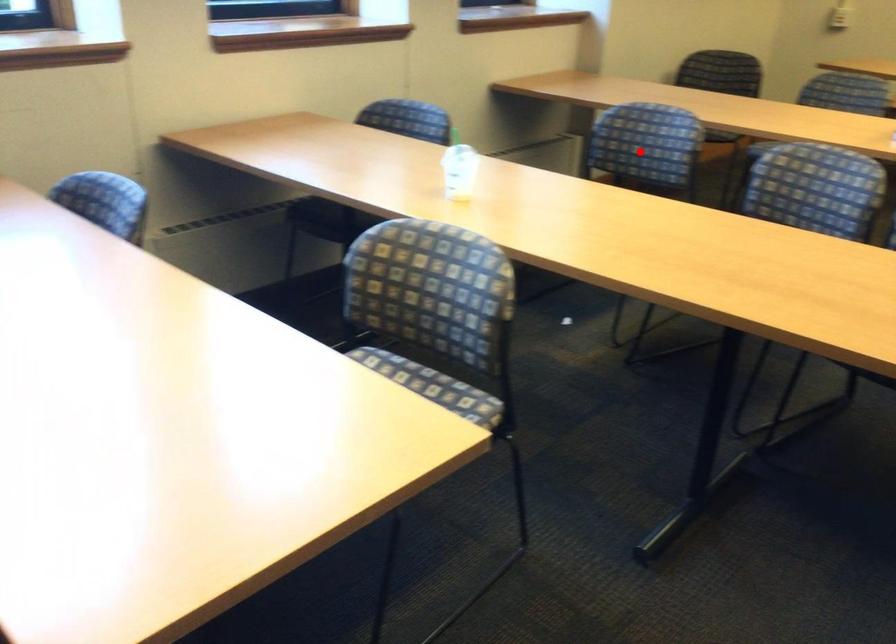
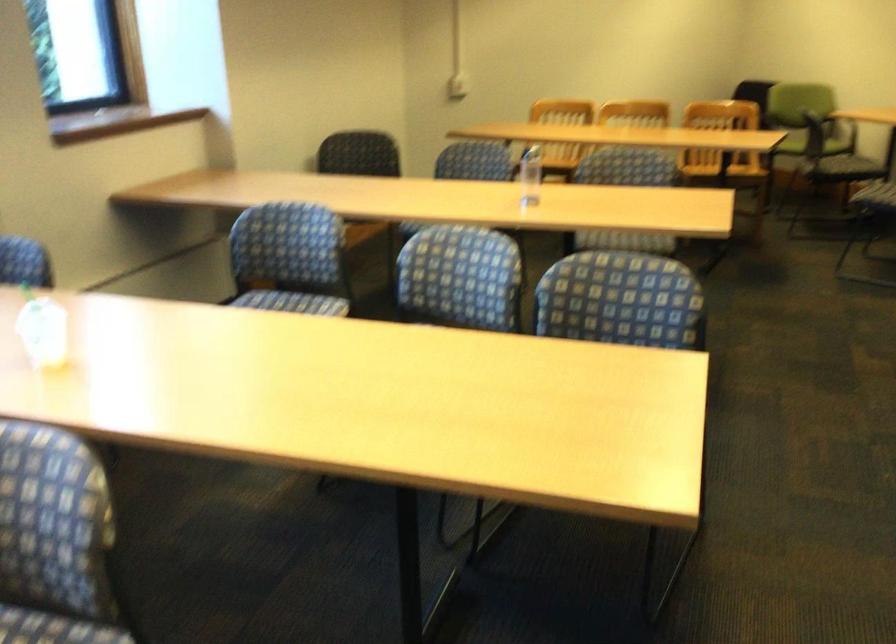
Where in the second image is the point corresponding to the highlighted location from the first image?

(289, 259)